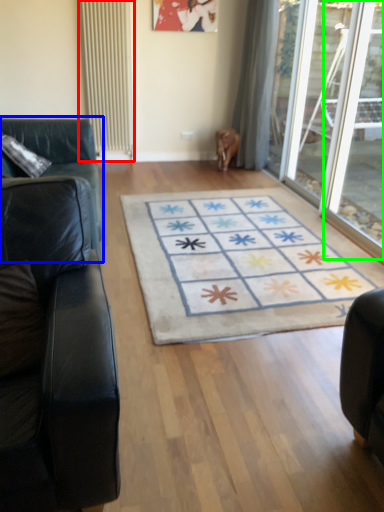
Question: Which object is positioned closest to radiator (highlighted by a red box)? Select from studio couch (highlighted by a blue box) and glass door (highlighted by a green box).

Choices:
 (A) studio couch
 (B) glass door

Answer: (A)